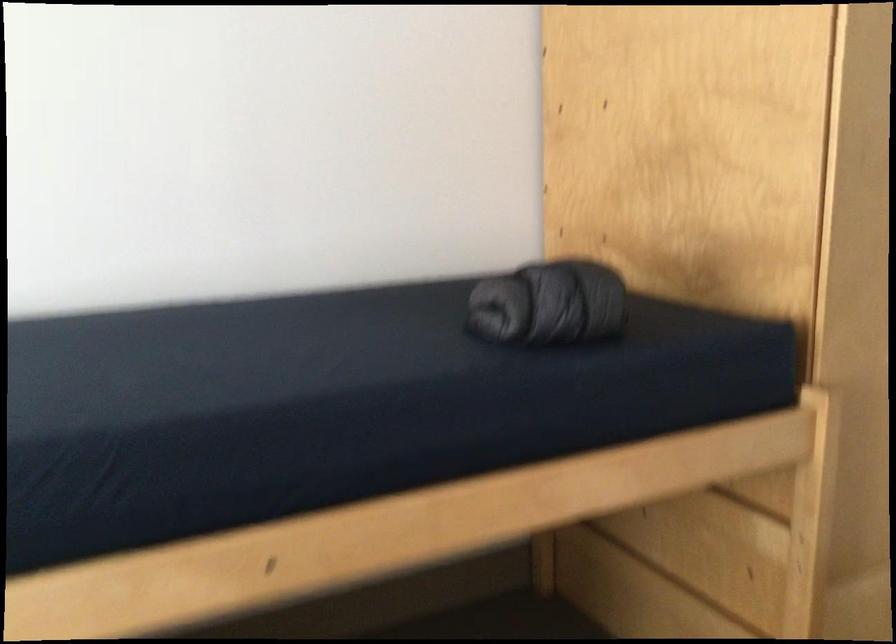
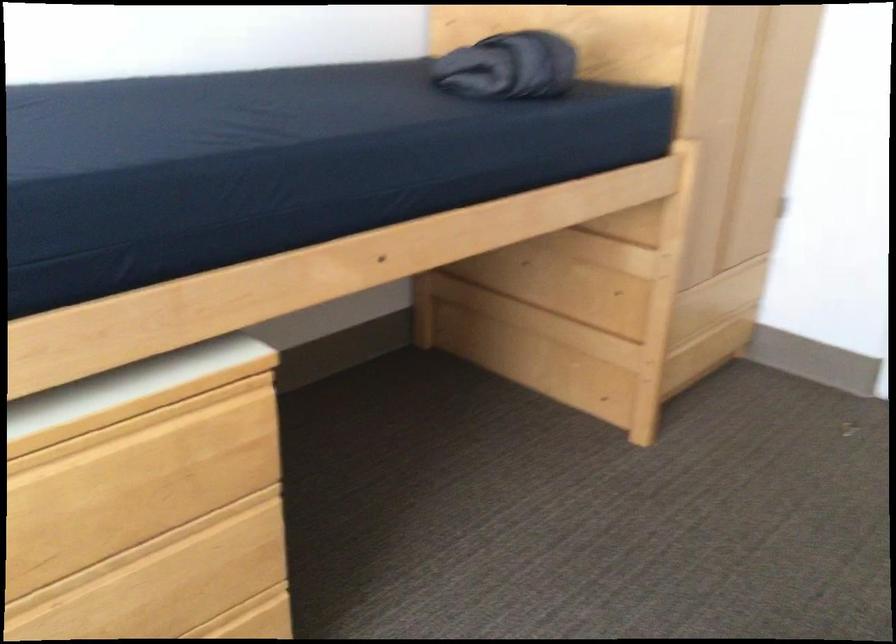
Locate, in the second image, the point that corresponds to the point at 535,303 in the first image.

(509, 67)